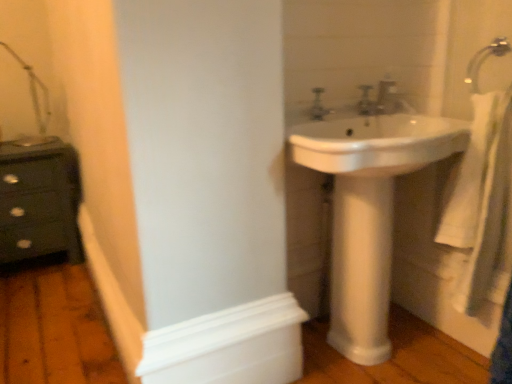
Question: From a real-world perspective, is satin nickel faucet at upper right, placed as the second plumbing fixture when sorted from left to right, physically below silver metallic faucet at upper right?

Choices:
 (A) no
 (B) yes

Answer: (B)

Question: From the image's perspective, is satin nickel faucet at upper right, placed as the second plumbing fixture when sorted from left to right, on top of silver metallic faucet at upper right?

Choices:
 (A) no
 (B) yes

Answer: (A)

Question: Does satin nickel faucet at upper right, placed as the first plumbing fixture when sorted from right to left, have a larger size compared to silver metallic faucet at upper right?

Choices:
 (A) no
 (B) yes

Answer: (A)

Question: Can you confirm if satin nickel faucet at upper right, placed as the second plumbing fixture when sorted from left to right, is positioned to the left of silver metallic faucet at upper right?

Choices:
 (A) no
 (B) yes

Answer: (B)

Question: Is satin nickel faucet at upper right, placed as the first plumbing fixture when sorted from right to left, not within silver metallic faucet at upper right?

Choices:
 (A) no
 (B) yes

Answer: (B)

Question: From a real-world perspective, is white matte molding at lower left positioned above or below dark green wooden chest of drawers at left?

Choices:
 (A) below
 (B) above

Answer: (A)

Question: Relative to dark green wooden chest of drawers at left, is white matte molding at lower left in front or behind?

Choices:
 (A) behind
 (B) front

Answer: (B)

Question: In terms of height, does white matte molding at lower left look taller or shorter compared to dark green wooden chest of drawers at left?

Choices:
 (A) short
 (B) tall

Answer: (A)

Question: In terms of width, does white matte molding at lower left look wider or thinner when compared to dark green wooden chest of drawers at left?

Choices:
 (A) wide
 (B) thin

Answer: (B)

Question: In the image, is matte silver faucet at upper center, the 1th plumbing fixture viewed from the left, positioned in front of or behind white glossy sink at center?

Choices:
 (A) front
 (B) behind

Answer: (B)

Question: Is matte silver faucet at upper center, the 1th plumbing fixture viewed from the left, situated inside white glossy sink at center or outside?

Choices:
 (A) outside
 (B) inside

Answer: (B)

Question: From the image's perspective, relative to white glossy sink at center, is matte silver faucet at upper center, the 1th plumbing fixture viewed from the left, above or below?

Choices:
 (A) above
 (B) below

Answer: (A)

Question: From a real-world perspective, is matte silver faucet at upper center, the 1th plumbing fixture viewed from the left, above or below white glossy sink at center?

Choices:
 (A) below
 (B) above

Answer: (B)

Question: Is silver metallic faucet at upper right inside or outside of white glossy sink at center?

Choices:
 (A) outside
 (B) inside

Answer: (B)

Question: Is silver metallic faucet at upper right taller or shorter than white glossy sink at center?

Choices:
 (A) short
 (B) tall

Answer: (A)